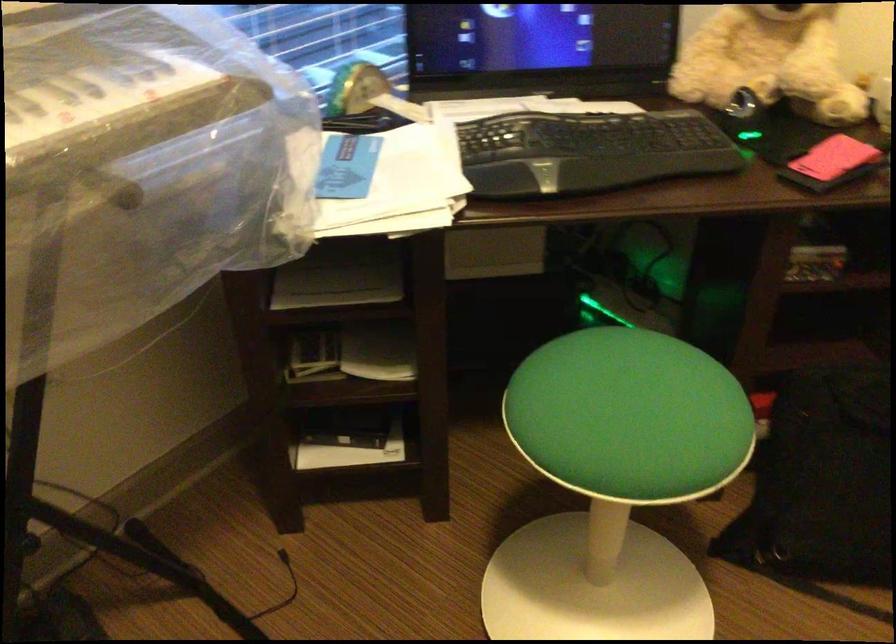
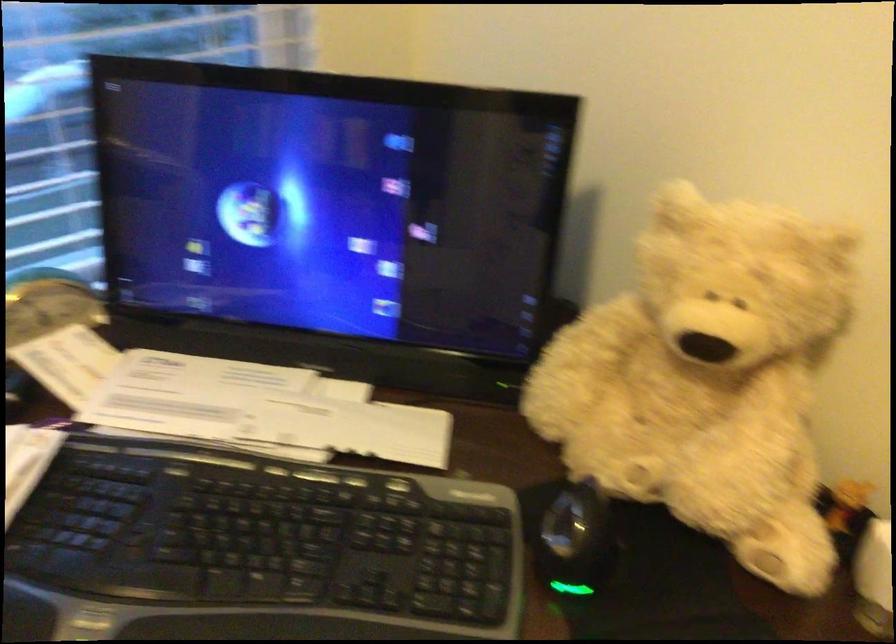
In a continuous first-person perspective shot, in which direction is the camera moving?

The movement direction of the cameraman is right, forward.